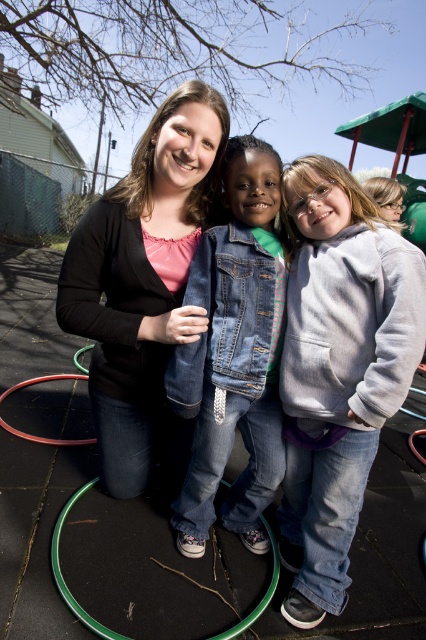
Which of these two, gray fleece hoodie at center or red rubber hula hoop at lower center, stands taller?

With more height is gray fleece hoodie at center.

At what (x,y) coordinates should I click in order to perform the action: click on gray fleece hoodie at center. Please return your answer as a coordinate pair (x, y). Looking at the image, I should click on (339, 369).

Can you confirm if black matte cardigan at center is positioned to the left of denim jacket at center?

Yes, black matte cardigan at center is to the left of denim jacket at center.

Is point (184, 307) farther from viewer compared to point (199, 506)?

No, (184, 307) is closer to viewer.

Who is more distant from viewer, (201, 90) or (252, 323)?

The point (201, 90) is behind.

You are a GUI agent. You are given a task and a screenshot of the screen. Output one action in this format:
    pyautogui.click(x=<x>, y=<y>)
    Task: Click on the black matte cardigan at center
    The height and width of the screenshot is (640, 426).
    Given the screenshot: What is the action you would take?
    pyautogui.click(x=141, y=276)

Is gray fleece hoodie at center below black matte cardigan at center?

Yes.

Who is more forward, (354,413) or (141,342)?

Point (354,413) is more forward.

Does point (412, 246) come farther from viewer compared to point (141, 326)?

No, (412, 246) is closer to viewer.

I want to click on gray fleece hoodie at center, so click(339, 369).